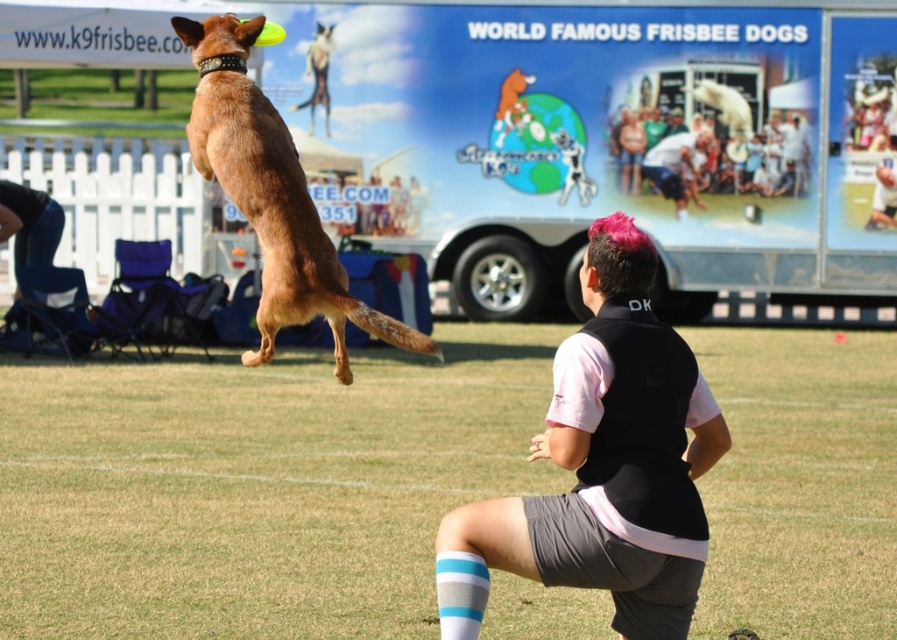
You are a photographer trying to capture the perfect shot of the pink hair at center and the brown matte dog at upper left. You want to ensure both subjects are clearly visible in the frame. Which subject should you focus on first to avoid blurring due to their size differences?

The pink hair at center is narrower than the brown matte dog at upper left, so you should focus on the brown matte dog at upper left first as it is larger and might require more attention to capture clearly without blurring.

You are a photographer trying to capture the perfect shot of the dog catching the frisbee. You notice the pink hair at center in the background. To avoid it from distracting the viewer, where should you position your camera to minimize its visibility?

The pink hair at center is located at point (x=603, y=465). To minimize its visibility, position the camera slightly to the left or right of this coordinate, adjusting the angle so the pink hair at center is either cropped out or less prominent in the frame.